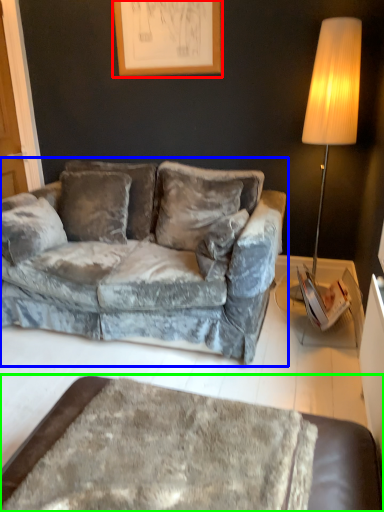
Question: Considering the real-world distances, which object is farthest from picture frame (highlighted by a red box)? studio couch (highlighted by a blue box) or table (highlighted by a green box)?

Choices:
 (A) studio couch
 (B) table

Answer: (B)